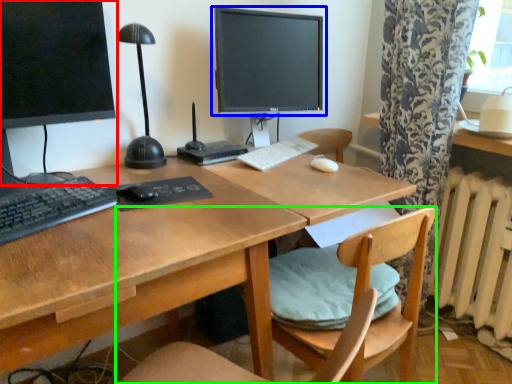
Question: Estimate the real-world distances between objects in this image. Which object is closer to computer monitor (highlighted by a red box), computer monitor (highlighted by a blue box) or chair (highlighted by a green box)?

Choices:
 (A) computer monitor
 (B) chair

Answer: (A)